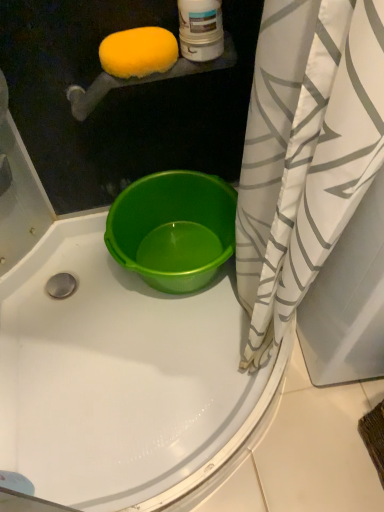
Image resolution: width=384 pixels, height=512 pixels. What do you see at coordinates (138, 52) in the screenshot? I see `yellow sponge at upper left` at bounding box center [138, 52].

Locate an element on the screen. The width and height of the screenshot is (384, 512). yellow sponge at upper left is located at coordinates (138, 52).

Does yellow sponge at upper left lie in front of white/gray striped shower curtain at right?

No, the depth of yellow sponge at upper left is greater than that of white/gray striped shower curtain at right.

Which object is positioned more to the right, yellow sponge at upper left or white/gray striped shower curtain at right?

Positioned to the right is white/gray striped shower curtain at right.

From the image's perspective, which object appears higher, yellow sponge at upper left or white/gray striped shower curtain at right?

yellow sponge at upper left.

This screenshot has height=512, width=384. What are the coordinates of `curtain on the right of yellow sponge at upper left` in the screenshot? It's located at (305, 152).

The height and width of the screenshot is (512, 384). Identify the location of lemon above the green plastic bucket at center (from the image's perspective). (138, 52).

Is green plastic bucket at center looking in the opposite direction of yellow sponge at upper left?

green plastic bucket at center is not turned away from yellow sponge at upper left.

From the image's perspective, is green plastic bucket at center under yellow sponge at upper left?

Yes, from the image's perspective, green plastic bucket at center is beneath yellow sponge at upper left.

Are green plastic bucket at center and yellow sponge at upper left located far from each other?

Actually, green plastic bucket at center and yellow sponge at upper left are a little close together.

The width and height of the screenshot is (384, 512). Identify the location of lemon behind the white/gray striped shower curtain at right. (138, 52).

Between white/gray striped shower curtain at right and yellow sponge at upper left, which one appears on the left side from the viewer's perspective?

yellow sponge at upper left is more to the left.

Is white/gray striped shower curtain at right smaller than yellow sponge at upper left?

Actually, white/gray striped shower curtain at right might be larger than yellow sponge at upper left.

Is white/gray striped shower curtain at right wider or thinner than yellow sponge at upper left?

white/gray striped shower curtain at right is wider than yellow sponge at upper left.

Is white/gray striped shower curtain at right wider than green plastic bucket at center?

Yes.

From a real-world perspective, which is physically below, white/gray striped shower curtain at right or green plastic bucket at center?

In real-world perspective, green plastic bucket at center is lower.

Is white/gray striped shower curtain at right shorter than green plastic bucket at center?

No, white/gray striped shower curtain at right is not shorter than green plastic bucket at center.

From the image's perspective, is white/gray striped shower curtain at right located above or below green plastic bucket at center?

white/gray striped shower curtain at right is above green plastic bucket at center.

Considering the sizes of objects yellow sponge at upper left and green plastic bucket at center in the image provided, who is shorter, yellow sponge at upper left or green plastic bucket at center?

With less height is yellow sponge at upper left.

From the image's perspective, is yellow sponge at upper left above or below green plastic bucket at center?

yellow sponge at upper left is situated higher than green plastic bucket at center in the image.

Is point (118, 32) positioned before point (205, 224)?

Yes, it is in front of point (205, 224).

Consider the image. Considering the sizes of objects green plastic bucket at center and white/gray striped shower curtain at right in the image provided, who is smaller, green plastic bucket at center or white/gray striped shower curtain at right?

green plastic bucket at center is smaller.

In the image, is green plastic bucket at center positioned in front of or behind white/gray striped shower curtain at right?

green plastic bucket at center is positioned farther from the viewer than white/gray striped shower curtain at right.

Is green plastic bucket at center facing away from white/gray striped shower curtain at right?

No, white/gray striped shower curtain at right is not at the back of green plastic bucket at center.

Looking at this image, is green plastic bucket at center taller or shorter than white/gray striped shower curtain at right?

In the image, green plastic bucket at center appears to be shorter than white/gray striped shower curtain at right.

Locate an element on the screen. The image size is (384, 512). lemon above the white/gray striped shower curtain at right (from the image's perspective) is located at coordinates (138, 52).

Identify the location of lemon located in front of the green plastic bucket at center. (138, 52).

Estimate the real-world distances between objects in this image. Which object is closer to green plastic bucket at center, yellow sponge at upper left or white/gray striped shower curtain at right?

white/gray striped shower curtain at right lies closer to green plastic bucket at center than the other object.

Estimate the real-world distances between objects in this image. Which object is closer to yellow sponge at upper left, white/gray striped shower curtain at right or green plastic bucket at center?

Based on the image, white/gray striped shower curtain at right appears to be nearer to yellow sponge at upper left.

Looking at the image, which one is located further to green plastic bucket at center, white/gray striped shower curtain at right or yellow sponge at upper left?

yellow sponge at upper left.

Based on their spatial positions, is green plastic bucket at center or yellow sponge at upper left closer to white/gray striped shower curtain at right?

green plastic bucket at center is positioned closer to the anchor white/gray striped shower curtain at right.

Looking at the image, which one is located further to white/gray striped shower curtain at right, yellow sponge at upper left or green plastic bucket at center?

yellow sponge at upper left is positioned further to the anchor white/gray striped shower curtain at right.

When comparing their distances from yellow sponge at upper left, does green plastic bucket at center or white/gray striped shower curtain at right seem further?

The object further to yellow sponge at upper left is green plastic bucket at center.

You are a GUI agent. You are given a task and a screenshot of the screen. Output one action in this format:
    pyautogui.click(x=<x>, y=<y>)
    Task: Click on the bucket situated between yellow sponge at upper left and white/gray striped shower curtain at right from left to right
    The height and width of the screenshot is (512, 384).
    Given the screenshot: What is the action you would take?
    pyautogui.click(x=173, y=229)